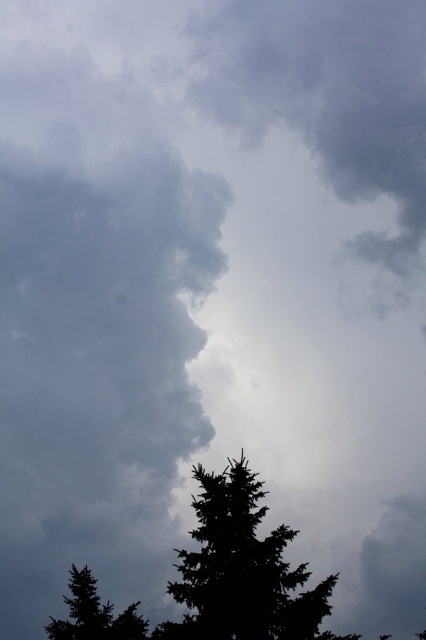
Question: Which object is farther from the camera taking this photo?

Choices:
 (A) black matte tree at center
 (B) green matte tree at lower left

Answer: (B)

Question: Does black matte tree at center have a larger size compared to green matte tree at lower left?

Choices:
 (A) no
 (B) yes

Answer: (B)

Question: Is black matte tree at center below green matte tree at lower left?

Choices:
 (A) no
 (B) yes

Answer: (A)

Question: Which object is closer to the camera taking this photo?

Choices:
 (A) black matte tree at center
 (B) green matte tree at lower left

Answer: (A)

Question: Is black matte tree at center below green matte tree at lower left?

Choices:
 (A) yes
 (B) no

Answer: (B)